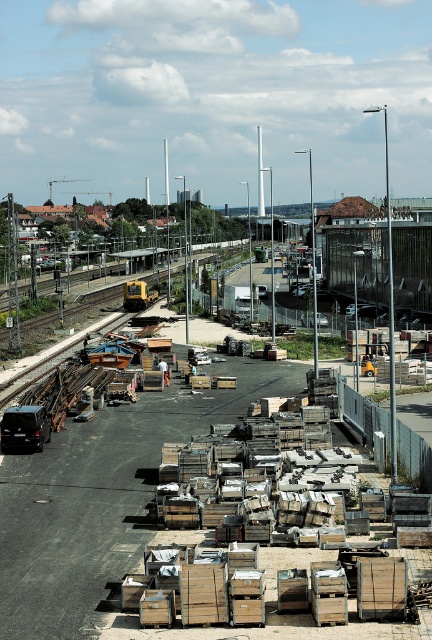
Who is higher up, wooden crates at center or yellow rubber train at center?

yellow rubber train at center

Does wooden crates at center have a greater width compared to yellow rubber train at center?

Indeed, wooden crates at center has a greater width compared to yellow rubber train at center.

Which is in front, point (207, 403) or point (130, 305)?

Point (207, 403) is more forward.

Where is `wooden crates at center`? This screenshot has width=432, height=640. wooden crates at center is located at coordinates (101, 499).